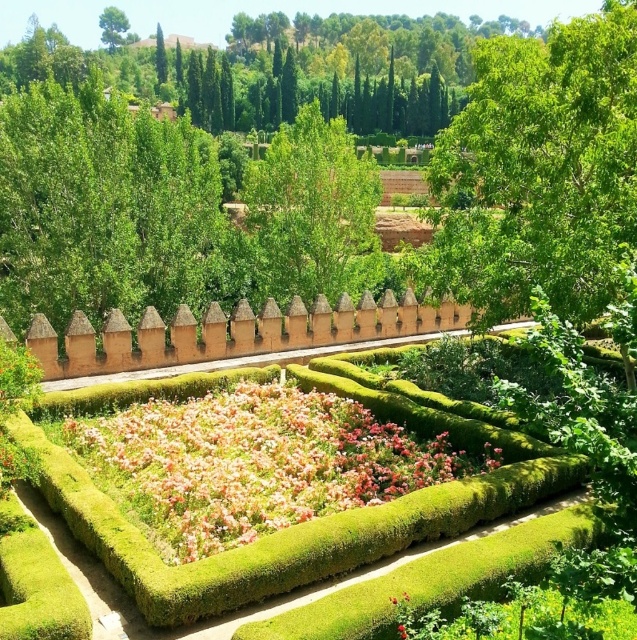
You are standing in the garden and want to take a photo of the green leafy tree at center and the green leafy tree at upper center. Which tree is positioned higher up in the image?

The green leafy tree at upper center is positioned higher up in the image than the green leafy tree at center.

You are planning to plant a new tree in the garden. You have a small sapling that needs a spot where it won not overshadow the green mossy hedge at center. Would the area near the green leafy tree at upper right be suitable?

The green leafy tree at upper right is already larger than the green mossy hedge at center, so planting a new sapling near it might not be suitable as it could grow to overshadow the hedge.